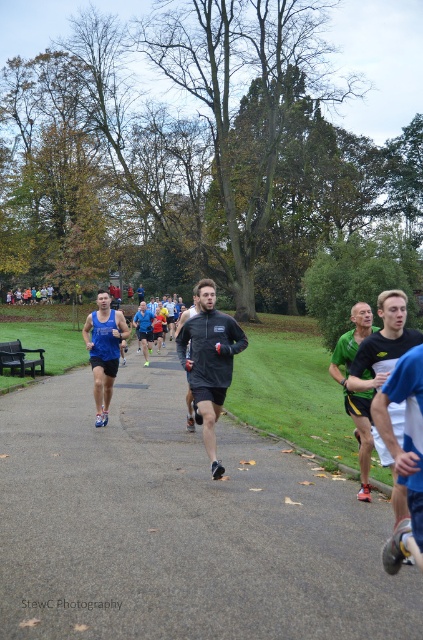
Question: Among these objects, which one is farthest from the camera?

Choices:
 (A) matte blue tank top at center
 (B) blue fabric running suit at center
 (C) green matte shirt at right

Answer: (B)

Question: Estimate the real-world distances between objects in this image. Which object is closer to the gray asphalt path at center?

Choices:
 (A) matte blue tank top at center
 (B) dark gray matte running shirt at center

Answer: (B)

Question: Which of the following is the closest to the observer?

Choices:
 (A) (395, 321)
 (B) (191, 417)

Answer: (A)

Question: Does green matte shirt at right appear on the left side of matte blue tank top at center?

Choices:
 (A) yes
 (B) no

Answer: (B)

Question: Can you confirm if green matte shirt at right is wider than blue fabric running suit at center?

Choices:
 (A) yes
 (B) no

Answer: (B)

Question: Does dark gray fleece jacket at center appear under matte blue tank top at center?

Choices:
 (A) no
 (B) yes

Answer: (B)